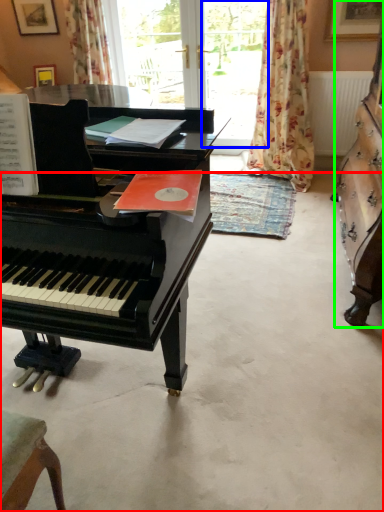
Question: Based on their relative distances, which object is nearer to concrete (highlighted by a red box)? Choose from window screen (highlighted by a blue box) and harpsichord (highlighted by a green box).

Choices:
 (A) window screen
 (B) harpsichord

Answer: (B)